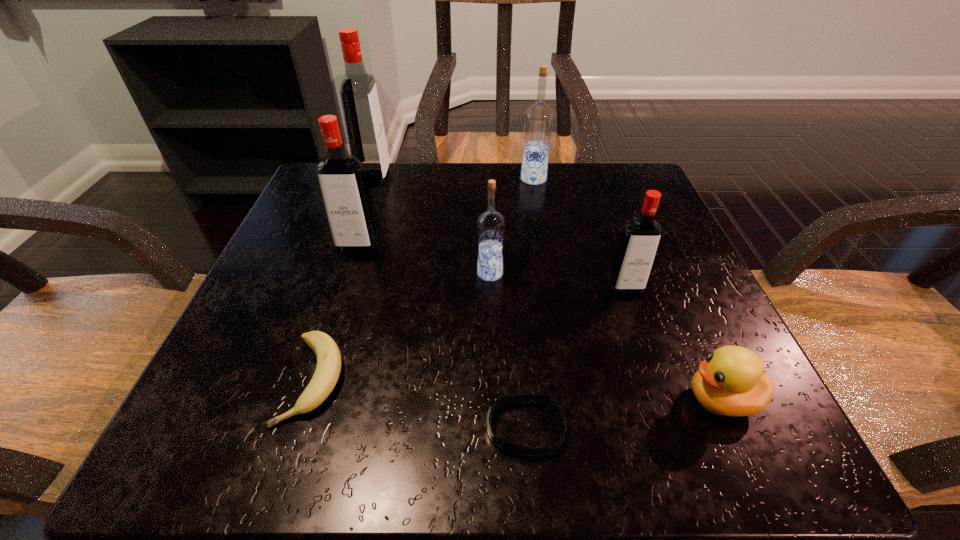
Locate an element on the screen. This screenshot has height=540, width=960. the third shortest object is located at coordinates (731, 382).

This screenshot has width=960, height=540. I want to click on yellow duckling, so click(x=731, y=382).

Image resolution: width=960 pixels, height=540 pixels. In order to click on the second shortest object in this screenshot , I will do `click(328, 368)`.

Where is `yellow banana`? This screenshot has height=540, width=960. yellow banana is located at coordinates (328, 368).

This screenshot has width=960, height=540. I want to click on wristband, so click(x=511, y=399).

Locate an element on the screen. Image resolution: width=960 pixels, height=540 pixels. vacant space located on the front and back of the tallest vodka is located at coordinates (515, 178).

Find the location of a particular element. free spot located on the front of the right blue vodka is located at coordinates (552, 289).

At what (x,y) coordinates should I click in order to perform the action: click on free location located on the front and back of the third nearest vodka. Please return your answer as a coordinate pair (x, y). This screenshot has width=960, height=540. Looking at the image, I should click on (337, 307).

Find the location of a particular element. free space located on the front and back of the nearest red vodka is located at coordinates (683, 450).

Identify the location of vacant space located 0.050m on the right of the third vodka from left to right. (533, 273).